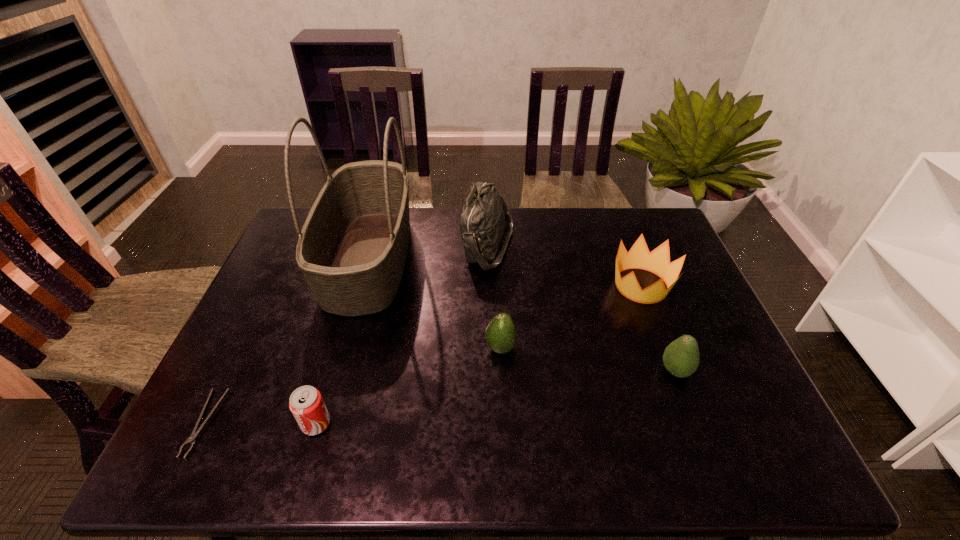
In the image, there is a desktop. Where is `vacant area at the right edge`? The height and width of the screenshot is (540, 960). vacant area at the right edge is located at coordinates (689, 333).

The image size is (960, 540). In the image, there is a desktop. In order to click on vacant space at the far right corner in this screenshot , I will do `click(621, 214)`.

Find the location of a particular element. free spot between the sixth shortest object and the soda can is located at coordinates [402, 335].

Image resolution: width=960 pixels, height=540 pixels. What are the coordinates of `free space between the right avocado and the left avocado` in the screenshot? It's located at (588, 359).

Where is `free space between the soda can and the tallest object`? This screenshot has width=960, height=540. free space between the soda can and the tallest object is located at coordinates (343, 341).

Locate an element on the screen. The width and height of the screenshot is (960, 540). vacant area between the leftmost object and the shoulder bag is located at coordinates coord(348,335).

Locate an element on the screen. free space between the basket and the soda can is located at coordinates (343, 341).

In order to click on vacant area that lies between the soda can and the right avocado in this screenshot , I will do pos(495,397).

Where is `unoccupied position between the left avocado and the basket`? The height and width of the screenshot is (540, 960). unoccupied position between the left avocado and the basket is located at coordinates (435, 303).

The width and height of the screenshot is (960, 540). Find the location of `unoccupied area between the left avocado and the tongs`. unoccupied area between the left avocado and the tongs is located at coordinates (353, 386).